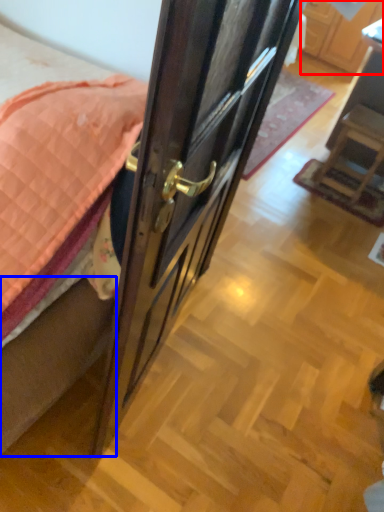
Question: Which point is closer to the camera, cabinetry (highlighted by a red box) or bed frame (highlighted by a blue box)?

Choices:
 (A) cabinetry
 (B) bed frame

Answer: (B)